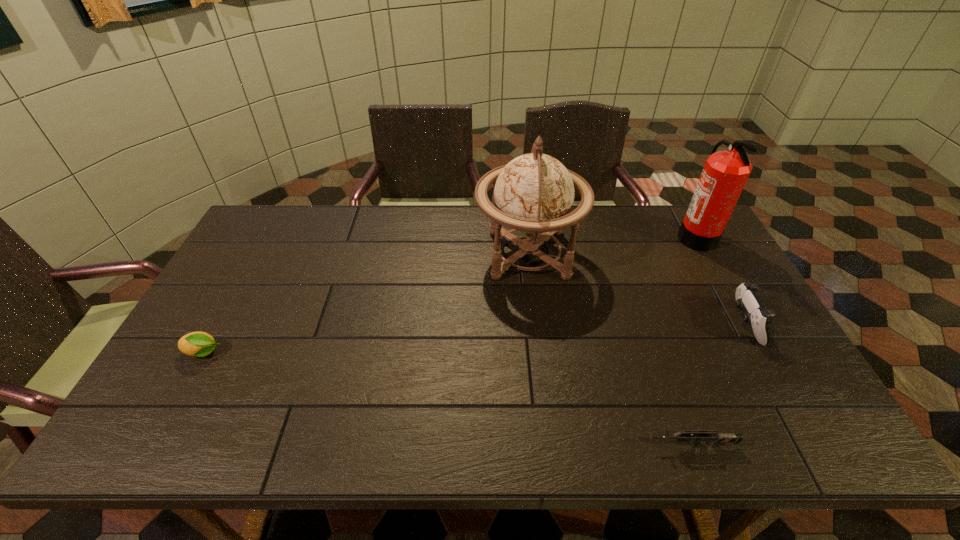
Locate an element on the screen. The height and width of the screenshot is (540, 960). free space at the far left corner of the desktop is located at coordinates (274, 232).

Find the location of a particular element. unoccupied position between the third object from right to left and the globe is located at coordinates (610, 350).

You are a GUI agent. You are given a task and a screenshot of the screen. Output one action in this format:
    pyautogui.click(x=<x>, y=<y>)
    Task: Click on the vacant space that is in between the fire extinguisher and the gun
    The image size is (960, 540).
    Given the screenshot: What is the action you would take?
    pyautogui.click(x=694, y=341)

At what (x,y) coordinates should I click in order to perform the action: click on unoccupied position between the leftmost object and the control. Please return your answer as a coordinate pair (x, y). Looking at the image, I should click on (474, 339).

Find the location of a particular element. Image resolution: width=960 pixels, height=540 pixels. free area in between the gun and the fourth object from right to left is located at coordinates (610, 350).

Where is `free point between the nearest object and the fire extinguisher`? The height and width of the screenshot is (540, 960). free point between the nearest object and the fire extinguisher is located at coordinates (694, 341).

What are the coordinates of `unoccupied position between the globe and the gun` in the screenshot? It's located at (610, 350).

Find the location of `free space between the fourth object from right to left and the third object from left to right`. free space between the fourth object from right to left and the third object from left to right is located at coordinates (610, 350).

I want to click on vacant area between the fire extinguisher and the globe, so click(x=612, y=246).

This screenshot has height=540, width=960. I want to click on free space between the control and the globe, so click(x=636, y=289).